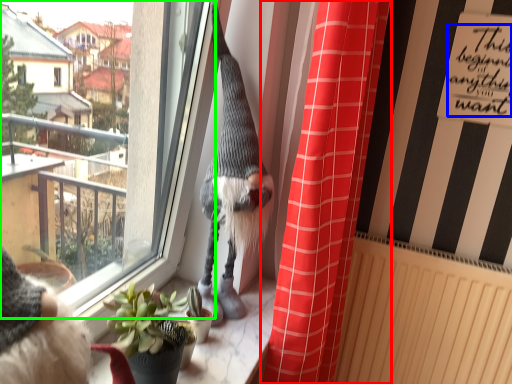
Question: Which is farther away from curtain (highlighted by a red box)? writing (highlighted by a blue box) or window (highlighted by a green box)?

Choices:
 (A) writing
 (B) window

Answer: (B)